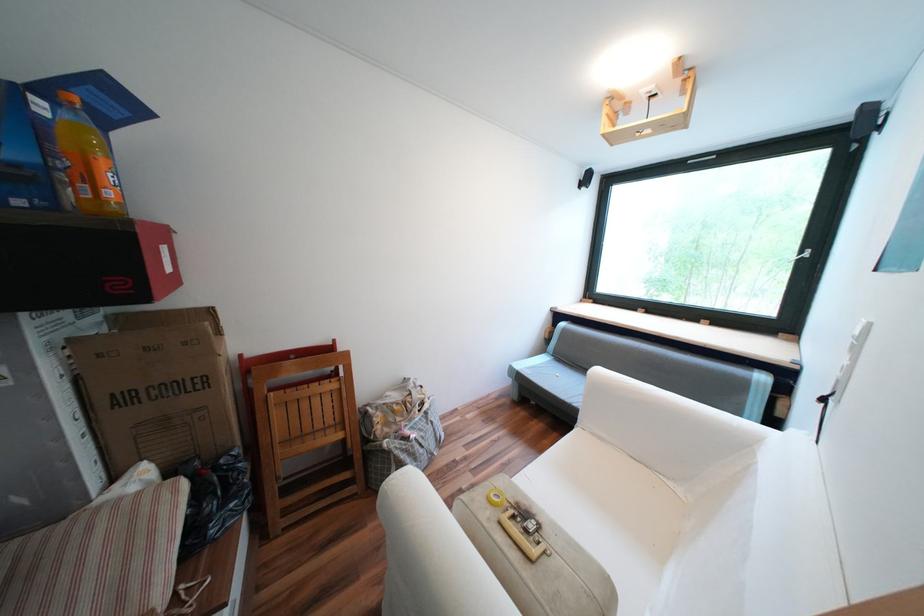
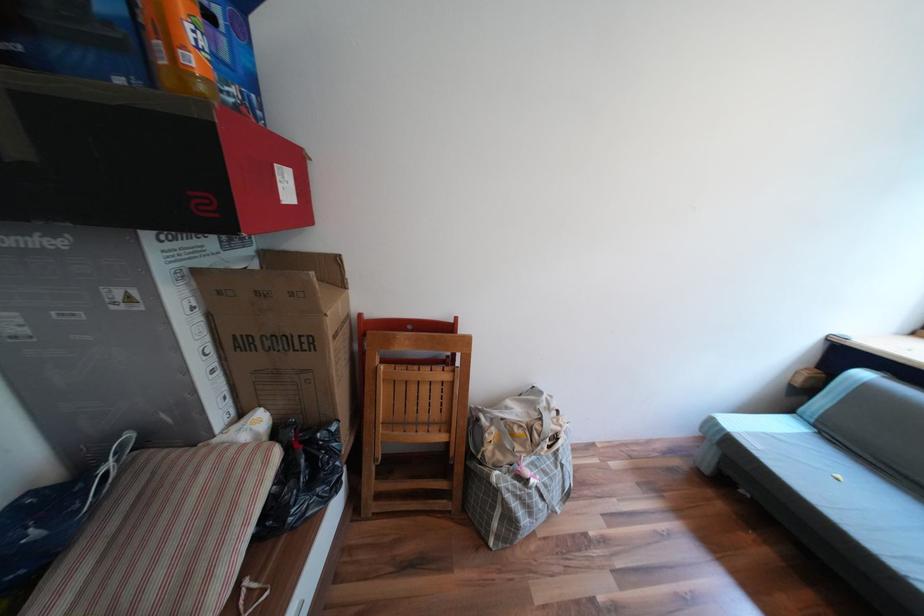
Locate, in the second image, the point that corresponds to pixel 89 415 in the first image.

(219, 349)